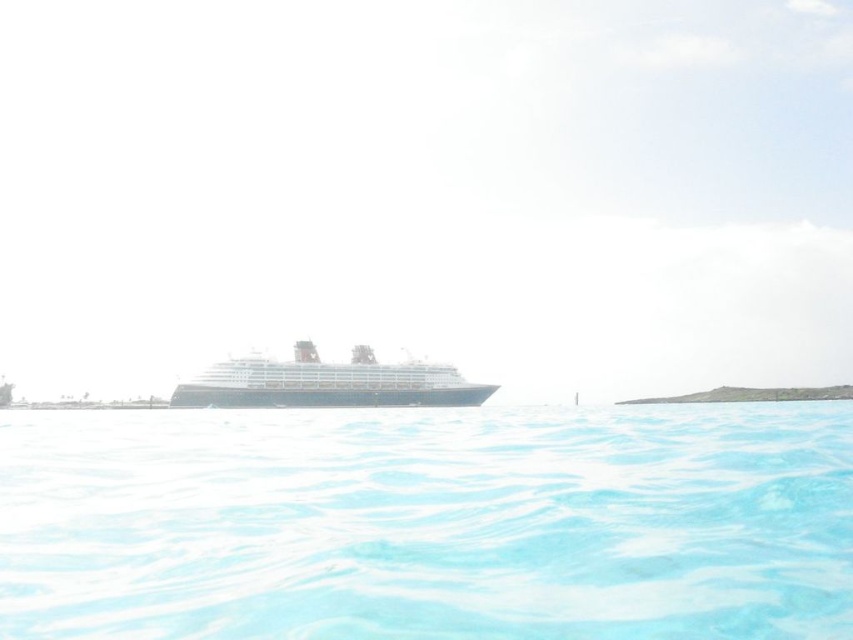
You are standing on the deck of the black glossy cruise ship at center and want to take a photo of the clear blue water at lower center. Which object should you focus on first to ensure both are in the frame?

You should focus on the clear blue water at lower center first since it is closer to the viewer than the black glossy cruise ship at center, ensuring both are in focus and properly framed.

You are on a boat and want to know where the clear blue water at lower center is located. What are its coordinates?

The clear blue water at lower center is located at coordinates point (428, 524).